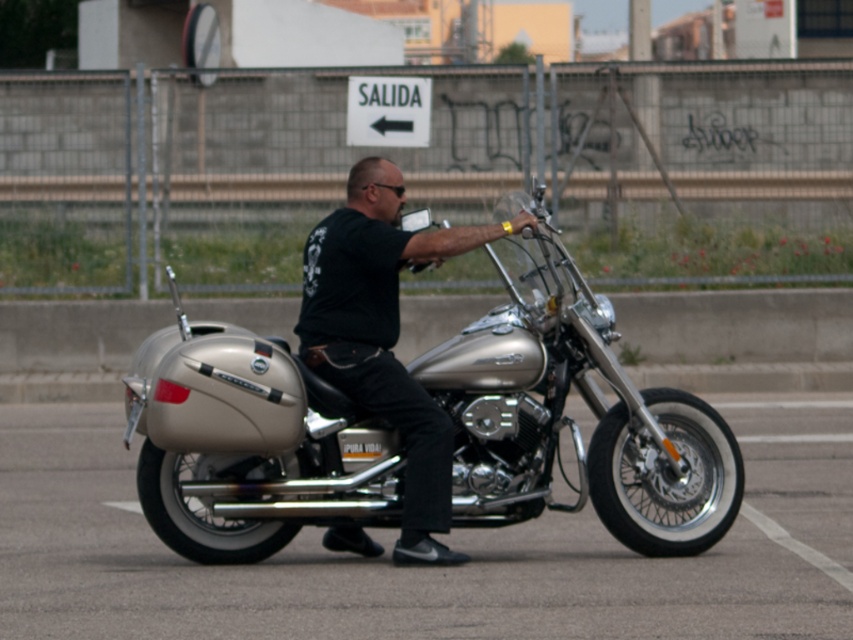
Question: Does metallic silver motorcycle at center have a smaller size compared to black matte shirt at center?

Choices:
 (A) no
 (B) yes

Answer: (A)

Question: Which object is closer to the camera taking this photo?

Choices:
 (A) black matte shirt at center
 (B) metallic silver motorcycle at center
 (C) silver metallic motorcycle at center

Answer: (B)

Question: Does silver metallic motorcycle at center come behind black matte shirt at center?

Choices:
 (A) yes
 (B) no

Answer: (B)

Question: Which point is farther from the camera taking this photo?

Choices:
 (A) (318, 404)
 (B) (402, 410)
 (C) (521, 540)

Answer: (C)

Question: Can you confirm if metallic silver motorcycle at center is bigger than black matte shirt at center?

Choices:
 (A) yes
 (B) no

Answer: (A)

Question: Which of the following is the farthest from the observer?

Choices:
 (A) 22,561
 (B) 672,461
 (C) 323,276

Answer: (A)